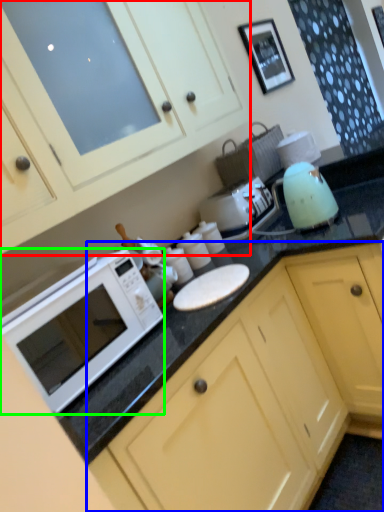
Question: Based on their relative distances, which object is nearer to cabinetry (highlighted by a red box)? Choose from cabinetry (highlighted by a blue box) and microwave oven (highlighted by a green box).

Choices:
 (A) cabinetry
 (B) microwave oven

Answer: (B)